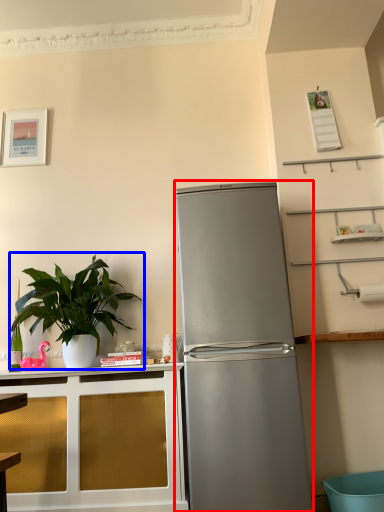
Question: Which point is further to the camera, refrigerator (highlighted by a red box) or houseplant (highlighted by a blue box)?

Choices:
 (A) refrigerator
 (B) houseplant

Answer: (B)